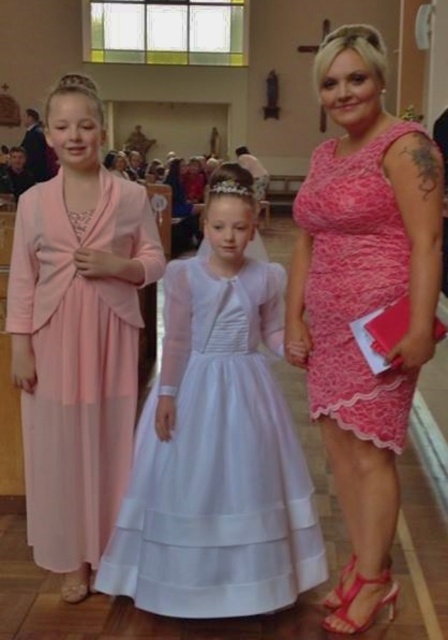
Measure the distance between point (137, 440) and camera.

A distance of 9.82 feet exists between point (137, 440) and camera.

Is point (112, 545) closer to viewer compared to point (392, 269)?

No, it is behind (392, 269).

Is point (147, 529) positioned in front of point (297, 208)?

That is True.

Find the location of a particular element. The image size is (448, 640). white satin dress at center is located at coordinates tap(216, 461).

The height and width of the screenshot is (640, 448). What are the coordinates of `white satin dress at center` in the screenshot? It's located at (216, 461).

From the picture: Who is more forward, (177, 580) or (120, 291)?

Point (177, 580) is more forward.

Find the location of a particular element. This screenshot has width=448, height=640. white satin dress at center is located at coordinates (216, 461).

Can you confirm if pink lace dress at center is bigger than white satin dress at center?

Correct, pink lace dress at center is larger in size than white satin dress at center.

Does pink lace dress at center have a greater height compared to white satin dress at center?

Indeed, pink lace dress at center has a greater height compared to white satin dress at center.

Does point (386, 292) come farther from viewer compared to point (254, 522)?

No.

Locate an element on the screen. The height and width of the screenshot is (640, 448). pink lace dress at center is located at coordinates (362, 300).